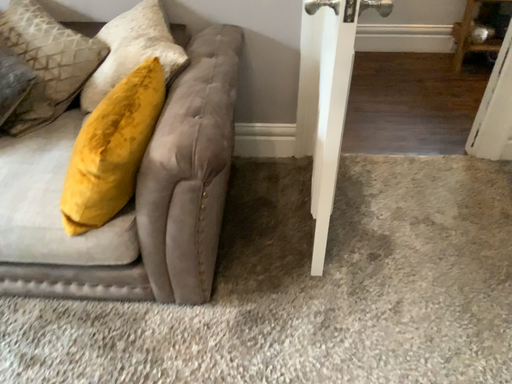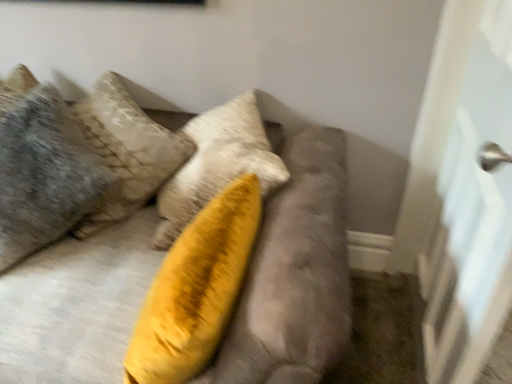
Question: Which way did the camera rotate in the video?

Choices:
 (A) rotated downward
 (B) rotated upward

Answer: (B)